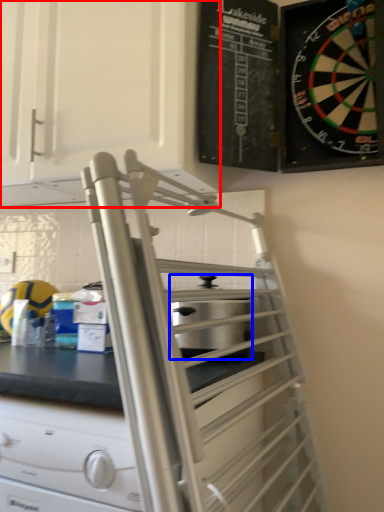
Question: Which object appears closest to the camera in this image, cabinetry (highlighted by a red box) or appliance (highlighted by a blue box)?

Choices:
 (A) cabinetry
 (B) appliance

Answer: (B)